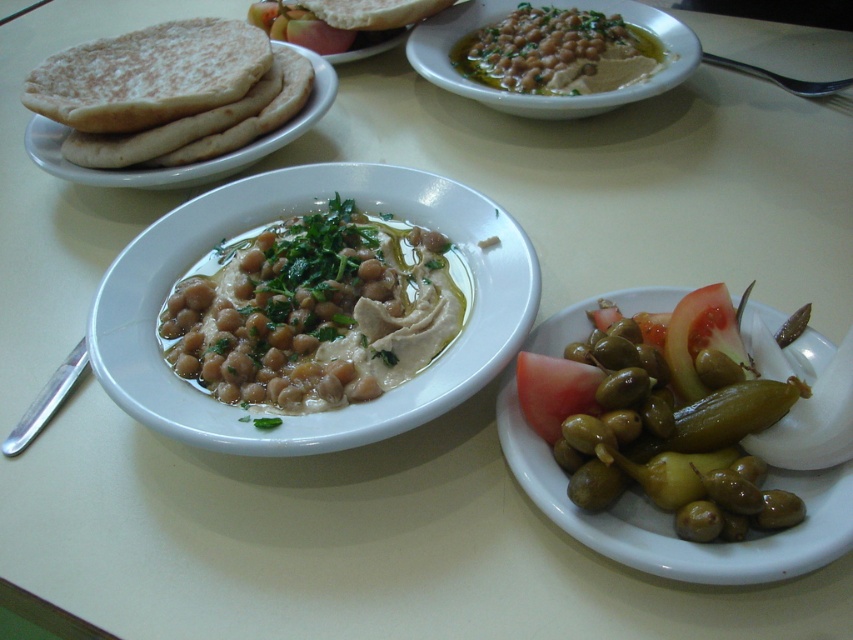
Question: Can you confirm if green glossy olives at lower right is wider than white flour tortilla at upper left?

Choices:
 (A) yes
 (B) no

Answer: (B)

Question: Which of the following is the closest to the observer?

Choices:
 (A) (114, 84)
 (B) (614, 525)
 (C) (270, 36)

Answer: (B)

Question: Is the position of matte olive oil hummus at upper center more distant than that of white flour tortilla at upper center?

Choices:
 (A) no
 (B) yes

Answer: (A)

Question: Which of these objects is positioned closest to the green glossy pickle at lower right?

Choices:
 (A) green olive at center
 (B) white flour tortilla at upper left
 (C) white creamy hummus at center

Answer: (C)

Question: Can you confirm if white creamy hummus at center is positioned below green olive at center?

Choices:
 (A) yes
 (B) no

Answer: (A)

Question: Among these objects, which one is nearest to the camera?

Choices:
 (A) white creamy hummus at center
 (B) green glossy olives at lower right
 (C) green olive at center

Answer: (B)